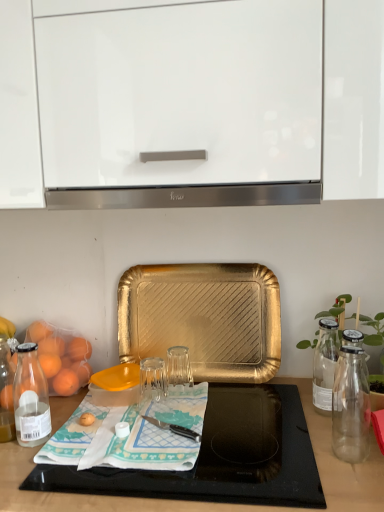
Where is `vacant space in front of transparent glass at center`? vacant space in front of transparent glass at center is located at coordinates (149, 442).